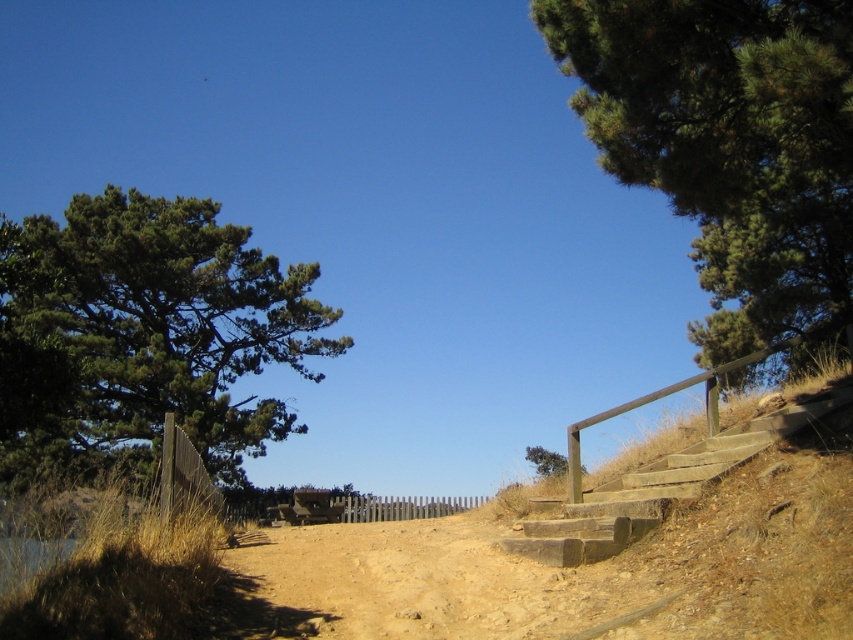
Question: Can you confirm if green textured tree at upper right is positioned below green needle-like tree at left?

Choices:
 (A) no
 (B) yes

Answer: (A)

Question: Which object is farther from the camera taking this photo?

Choices:
 (A) green matte tree at center
 (B) green needle-like tree at left
 (C) green textured tree at upper right

Answer: (A)

Question: Among these points, which one is farthest from the camera?

Choices:
 (A) (595, 45)
 (B) (299, 371)
 (C) (554, 461)
 (D) (323, 609)

Answer: (C)

Question: Where is green needle-like tree at left located in relation to wooden stairs at center-right in the image?

Choices:
 (A) right
 (B) left

Answer: (B)

Question: Estimate the real-world distances between objects in this image. Which object is farther from the green needle-like tree at left?

Choices:
 (A) brown/dry soil at center
 (B) green matte tree at center
 (C) green textured tree at upper right

Answer: (A)

Question: Does green textured tree at upper right have a larger size compared to green matte tree at center?

Choices:
 (A) yes
 (B) no

Answer: (B)